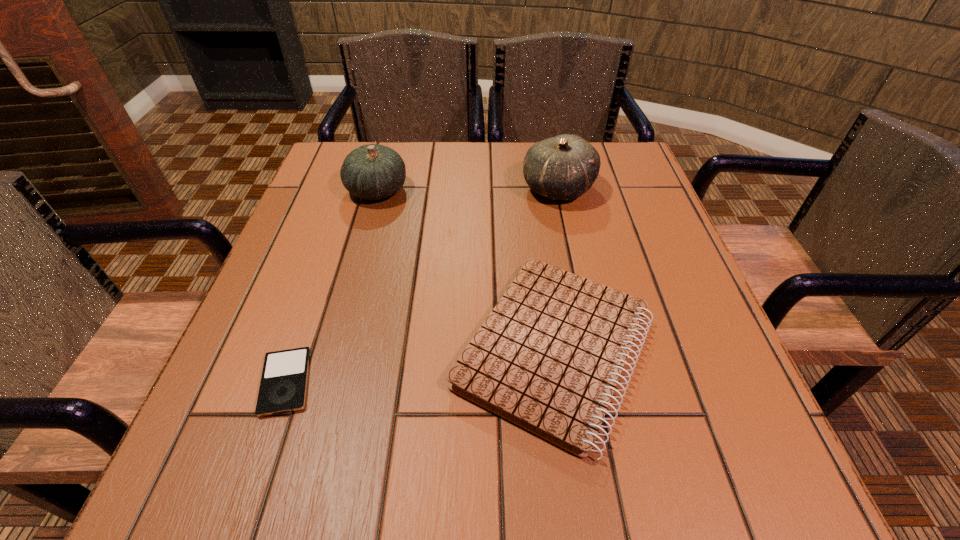
At what (x,y) coordinates should I click in order to perform the action: click on the second closest object to the notebook. Please return your answer as a coordinate pair (x, y). Image resolution: width=960 pixels, height=540 pixels. Looking at the image, I should click on (283, 386).

You are a GUI agent. You are given a task and a screenshot of the screen. Output one action in this format:
    pyautogui.click(x=<x>, y=<y>)
    Task: Click on the object that is the closest to the right gourd
    This screenshot has width=960, height=540.
    Given the screenshot: What is the action you would take?
    pyautogui.click(x=548, y=358)

I want to click on vacant space that satisfies the following two spatial constraints: 1. on the back side of the notebook; 2. on the right side of the right gourd, so click(x=532, y=189).

Where is `free space that satisfies the following two spatial constraints: 1. on the back side of the iPod; 2. on the right side of the right gourd`? free space that satisfies the following two spatial constraints: 1. on the back side of the iPod; 2. on the right side of the right gourd is located at coordinates (352, 189).

Where is `free space in the image that satisfies the following two spatial constraints: 1. on the back side of the right gourd; 2. on the right side of the iPod`? The image size is (960, 540). free space in the image that satisfies the following two spatial constraints: 1. on the back side of the right gourd; 2. on the right side of the iPod is located at coordinates (352, 189).